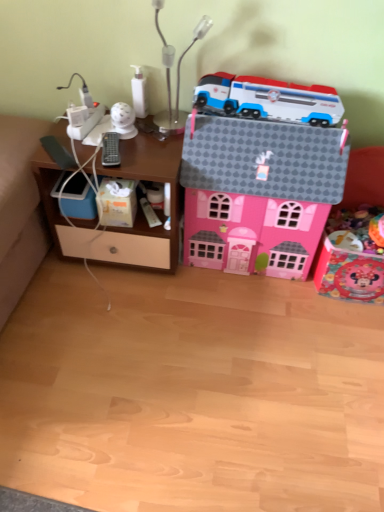
Find the location of a particular element. The width and height of the screenshot is (384, 512). vacant area on top of woodenmaterial/texturecomputer desk at left (from a real-world perspective) is located at coordinates (129, 144).